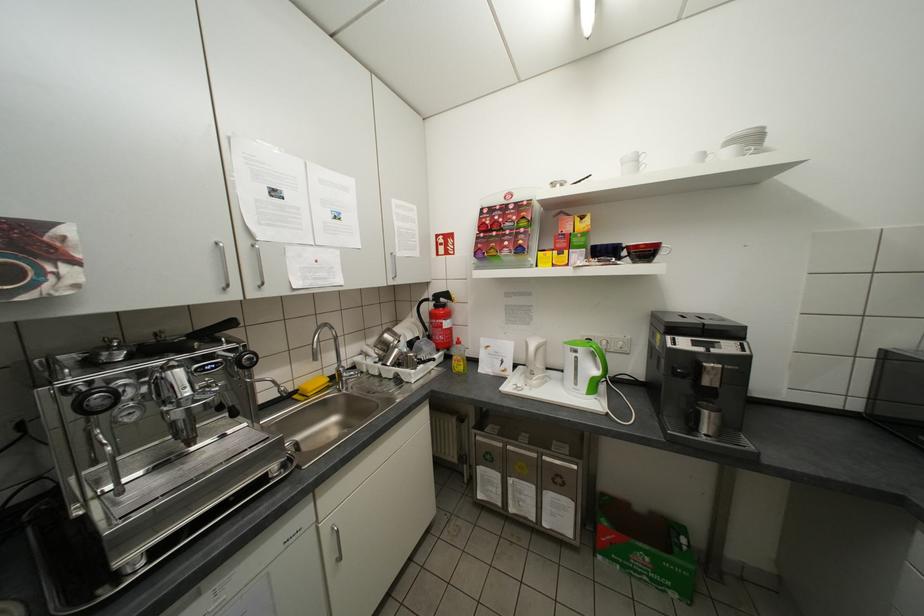
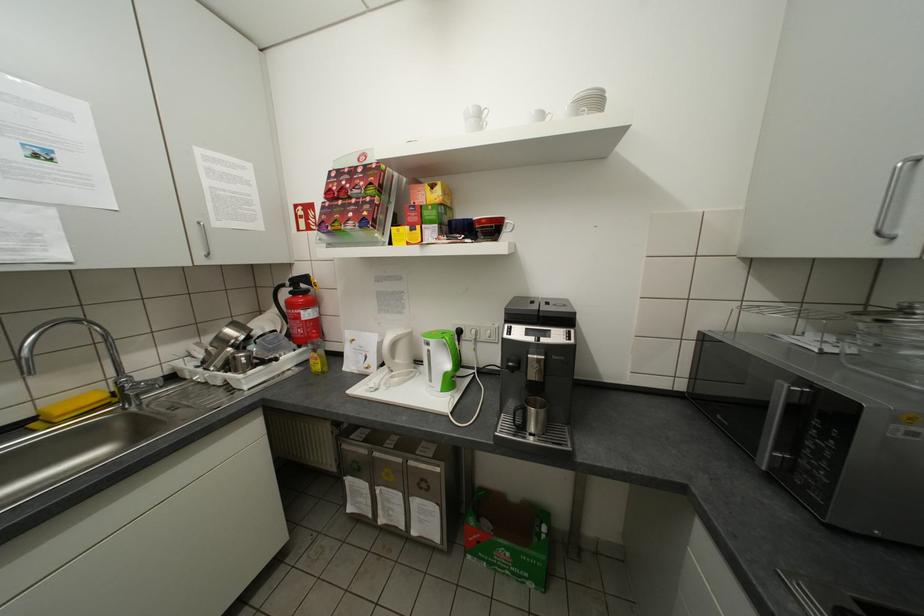
Locate, in the second image, the point that corresponds to pixel 681 568 in the first image.

(537, 560)